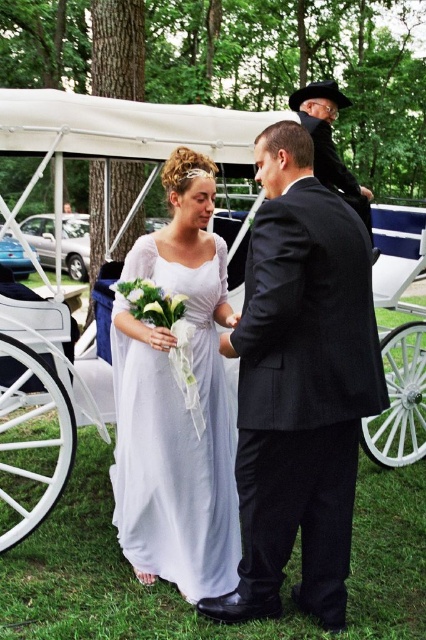
Is white fabric coach at center bigger than black leather coach at upper center?

Yes.

Is the position of white fabric coach at center less distant than that of black leather coach at upper center?

That is True.

Who is more forward, (282, 120) or (304, 122)?

Point (282, 120)

At what (x,y) coordinates should I click in order to perform the action: click on white fabric coach at center. Please return your answer as a coordinate pair (x, y). The image size is (426, 640). Looking at the image, I should click on (299, 385).

Which is in front, point (385, 460) or point (348, 180)?

Positioned in front is point (348, 180).

Locate an element on the screen. white wood horse cart at center is located at coordinates (66, 285).

In order to click on white wood horse cart at center in this screenshot , I will do `click(66, 285)`.

Does white chiffon dress at center have a lesser width compared to black leather coach at upper center?

No.

Does point (195, 518) come farther from viewer compared to point (330, 124)?

No, (195, 518) is in front of (330, 124).

This screenshot has height=640, width=426. Find the location of `white chiffon dress at center`. white chiffon dress at center is located at coordinates (175, 436).